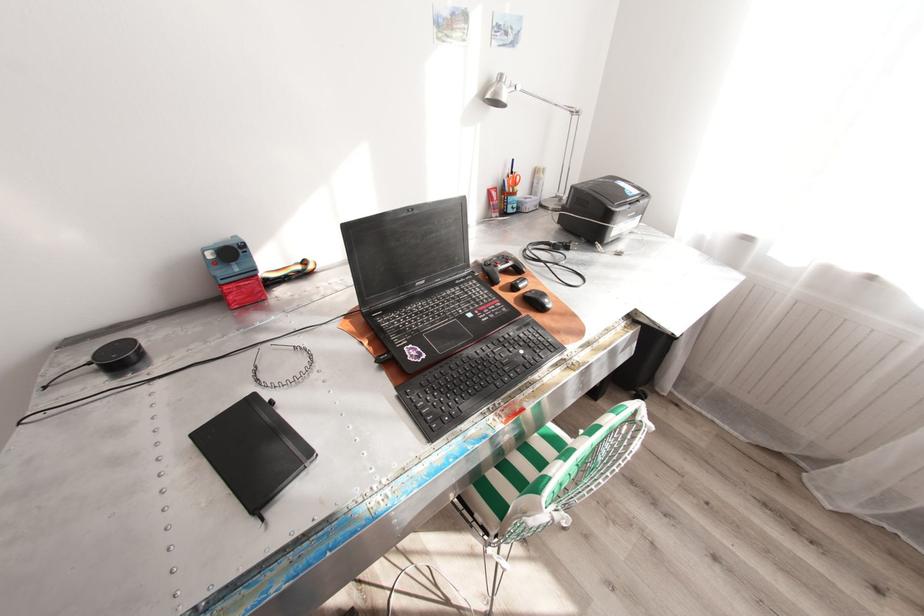
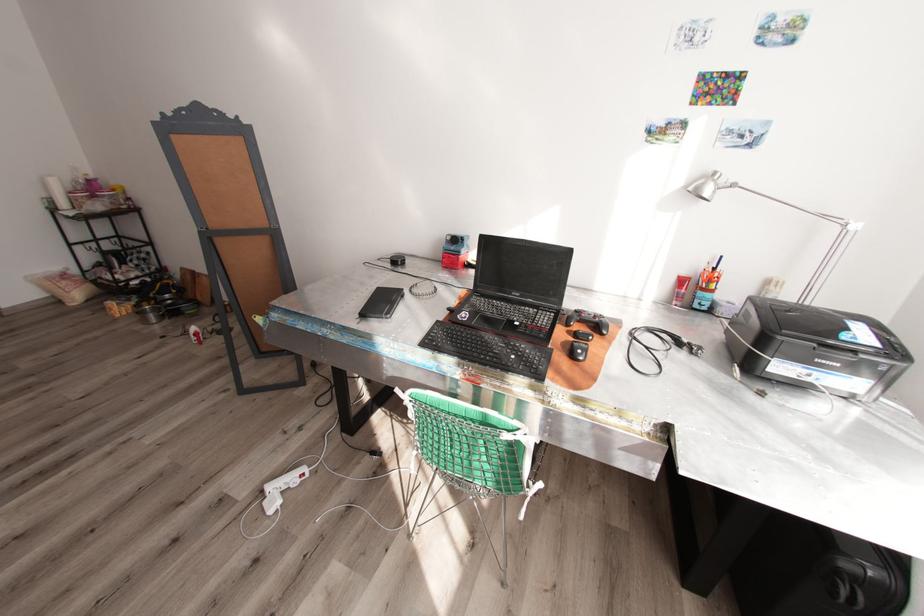
The point at (551, 300) is marked in the first image. Where is the corresponding point in the second image?

(584, 351)